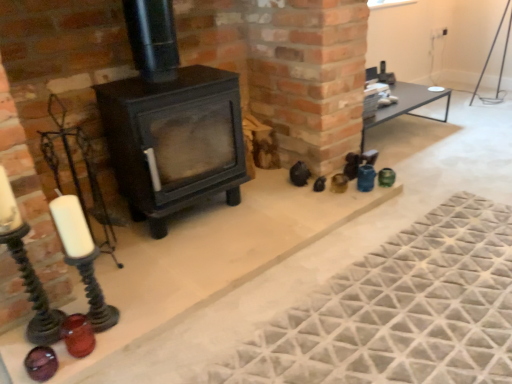
Question: Is matte black stove at center situated inside textured gray mat at lower right or outside?

Choices:
 (A) inside
 (B) outside

Answer: (B)

Question: Relative to textured gray mat at lower right, is matte black stove at center in front or behind?

Choices:
 (A) behind
 (B) front

Answer: (B)

Question: Estimate the real-world distances between objects in this image. Which object is closer to the matte black wood burning stove at center?

Choices:
 (A) matte black stove at center
 (B) textured gray mat at lower right
 (C) translucent amber glass candle holder at lower left

Answer: (A)

Question: Which object is the closest to the translucent amber glass candle holder at lower left?

Choices:
 (A) matte black stove at center
 (B) matte black wood burning stove at center
 (C) textured gray mat at lower right

Answer: (B)